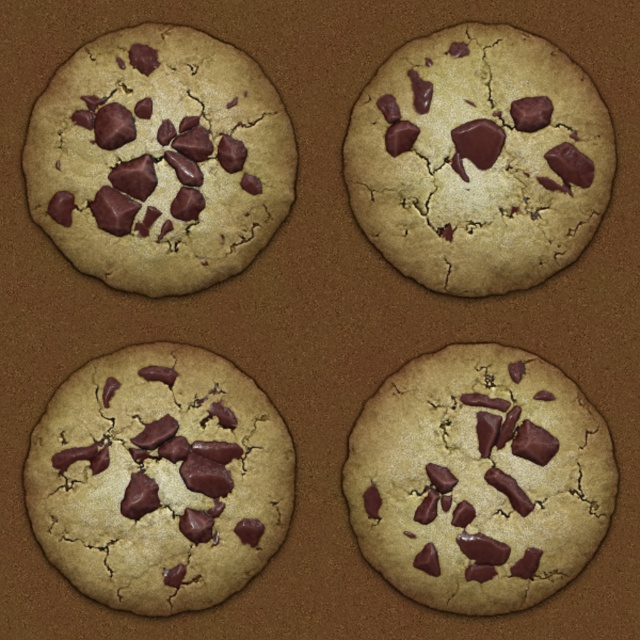
Question: Does matte brown cookie at bottom right have a larger size compared to matte brown cookie at bottom left?

Choices:
 (A) no
 (B) yes

Answer: (A)

Question: Which object is the closest to the matte chocolate chip cookie at upper left?

Choices:
 (A) matte brown cookie at bottom right
 (B) matte brown cookie at bottom left
 (C) matte chocolate chip cookie at upper right

Answer: (B)

Question: Can you confirm if matte chocolate chip cookie at upper left is bigger than matte brown cookie at bottom left?

Choices:
 (A) yes
 (B) no

Answer: (A)

Question: Observing the image, what is the correct spatial positioning of matte brown cookie at bottom right in reference to matte chocolate chip cookie at upper left?

Choices:
 (A) left
 (B) right

Answer: (B)

Question: Which object is positioned farthest from the matte brown cookie at bottom right?

Choices:
 (A) matte brown cookie at bottom left
 (B) matte chocolate chip cookie at upper left

Answer: (B)

Question: Which point appears closest to the camera in this image?

Choices:
 (A) (113, 572)
 (B) (65, 250)

Answer: (A)